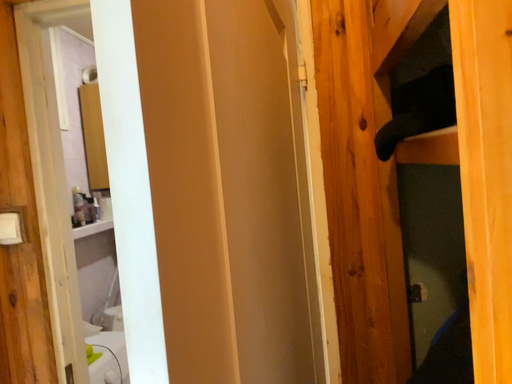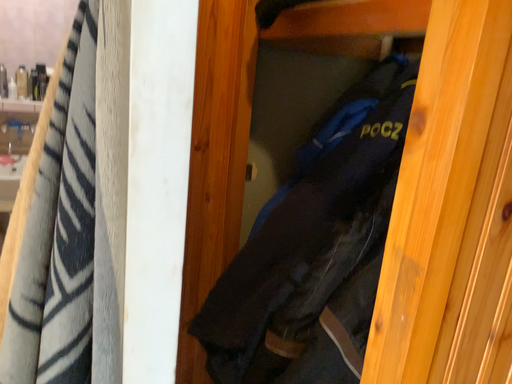
Question: How did the camera likely rotate when shooting the video?

Choices:
 (A) rotated downward
 (B) rotated upward

Answer: (A)